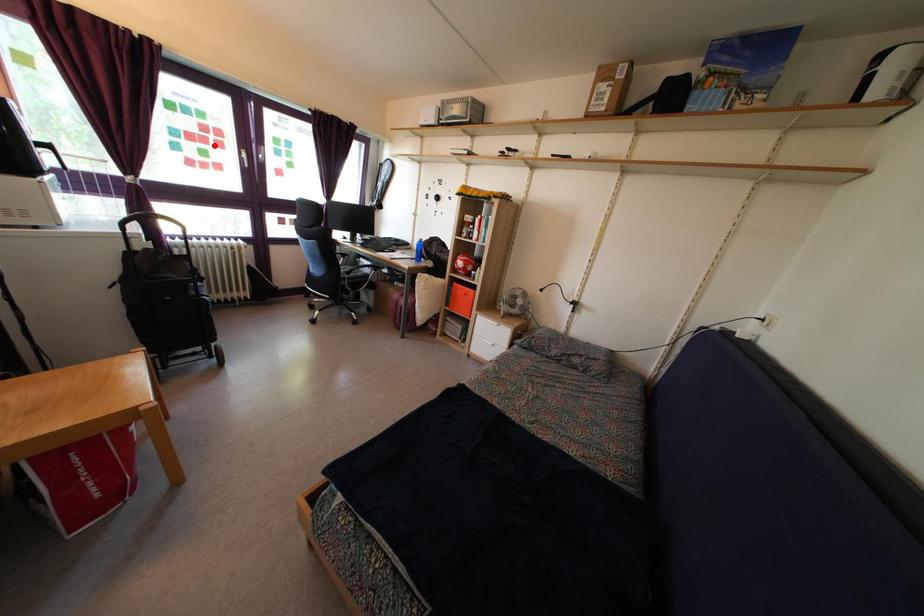
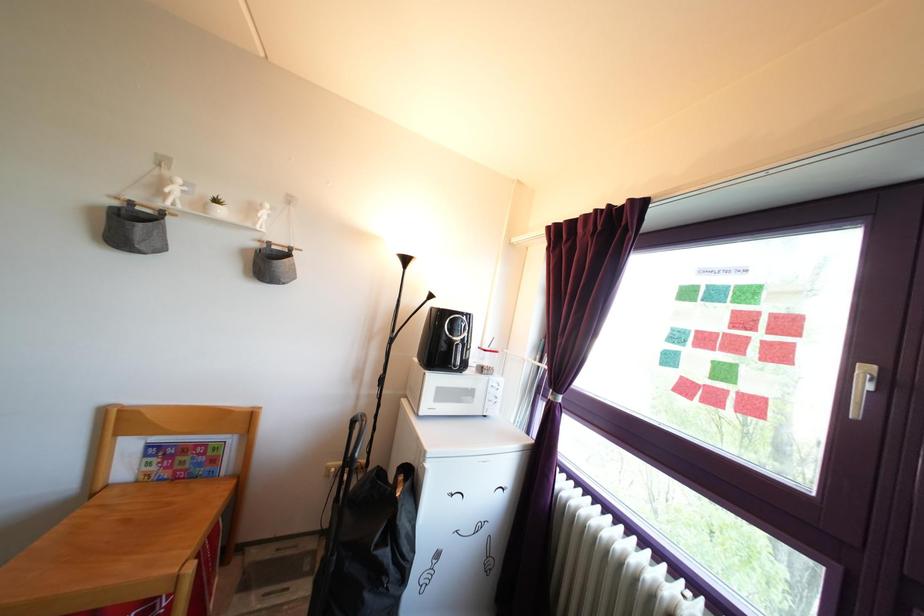
Question: I am providing you with two images of the same scene from different viewpoints. A red point is marked on the first image. At the location where the point appears in image 1, is it still visible in image 2?

Choices:
 (A) Yes
 (B) No

Answer: (A)